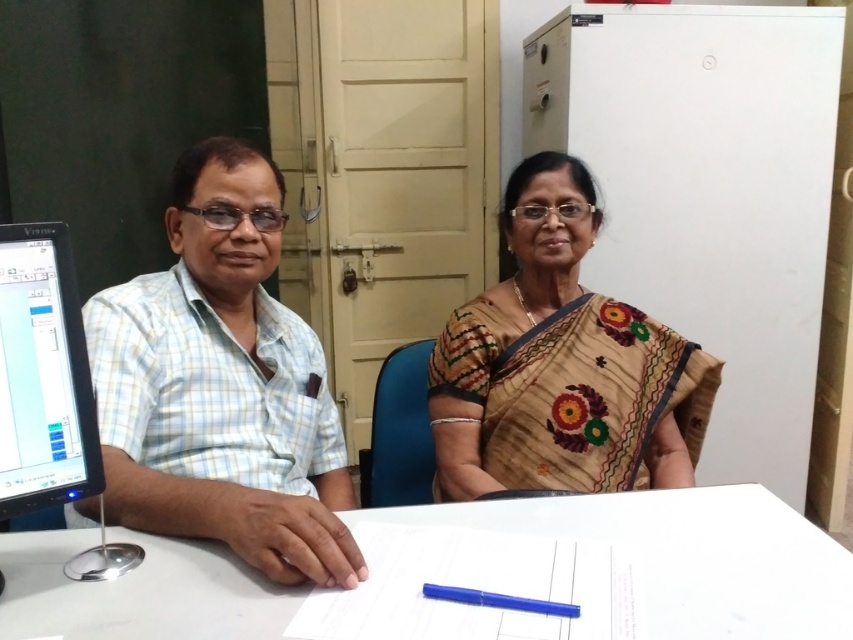
You are an office assistant who needs to hand a document to the person wearing the light blue checkered shirt at left. The document is currently on the table in front of the black glossy monitor at left. Can you reach the document without moving around the table?

The light blue checkered shirt at left is to the right of the black glossy monitor at left, so the person wearing the light blue checkered shirt at left is closer to the document on the table in front of the black glossy monitor at left. Therefore, you can reach the document without needing to move around the table.

In the scene shown: You are standing in front of the table where the two individuals are seated. The table has a piece of paper and a blue pen. Where is the black glossy monitor at left located relative to the table?

The black glossy monitor at left is located at the left side of the table, positioned at the 2D coordinates point (44, 374).

You are a photographer standing 3 feet away from the table where the light blue checkered shirt at left is placed. You want to take a closeup shot of the shirt. Is your current distance sufficient to capture the shirt clearly without moving closer?

The distance of light blue checkered shirt at left from camera is 31.39 inches, which is approximately 2.6 feet. Since you are standing 3 feet away, you are slightly farther than the shirt, so moving a little closer would ensure clarity.